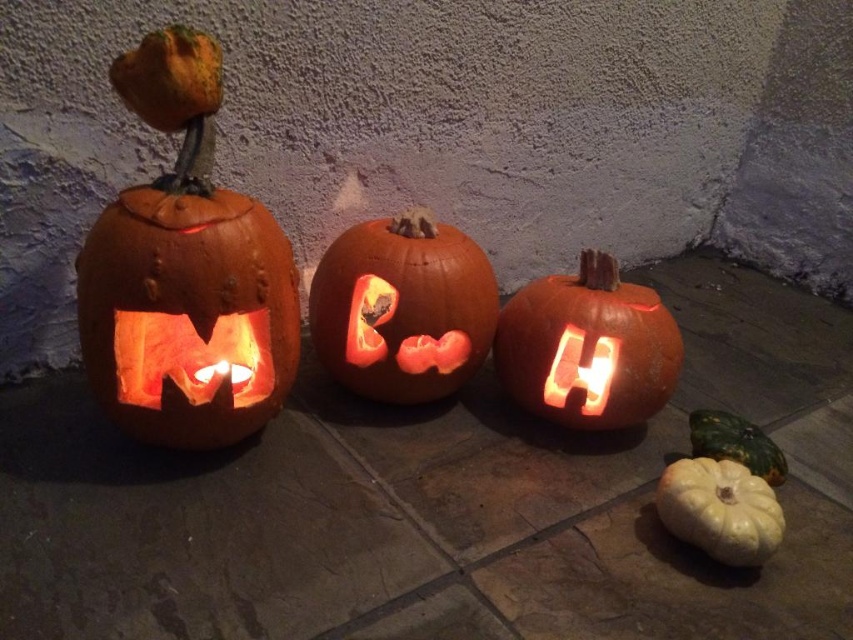
Can you confirm if orange carved pumpkin at center is wider than smooth white pumpkin at lower right?

Correct, the width of orange carved pumpkin at center exceeds that of smooth white pumpkin at lower right.

Measure the distance between orange carved pumpkin at center and camera.

orange carved pumpkin at center is 3.91 feet from camera.

Between point (437, 234) and point (769, 528), which one is positioned behind?

The point (437, 234) is more distant.

You are a GUI agent. You are given a task and a screenshot of the screen. Output one action in this format:
    pyautogui.click(x=<x>, y=<y>)
    Task: Click on the orange carved pumpkin at center
    
    Given the screenshot: What is the action you would take?
    pyautogui.click(x=402, y=307)

How much distance is there between orange carved pumpkin at center and orange matte carved pumpkin at center?

orange carved pumpkin at center is 7.42 inches away from orange matte carved pumpkin at center.

How much distance is there between orange carved pumpkin at center and orange matte carved pumpkin at center?

orange carved pumpkin at center and orange matte carved pumpkin at center are 7.42 inches apart from each other.

Where is `orange carved pumpkin at center`? orange carved pumpkin at center is located at coordinates pos(402,307).

Image resolution: width=853 pixels, height=640 pixels. I want to click on orange carved pumpkin at center, so tap(402, 307).

Looking at this image, can you confirm if carved orange pumpkin at left is positioned to the left of smooth white gourd at lower right?

Correct, you'll find carved orange pumpkin at left to the left of smooth white gourd at lower right.

The width and height of the screenshot is (853, 640). What do you see at coordinates (184, 273) in the screenshot? I see `carved orange pumpkin at left` at bounding box center [184, 273].

Identify the location of carved orange pumpkin at left. pos(184,273).